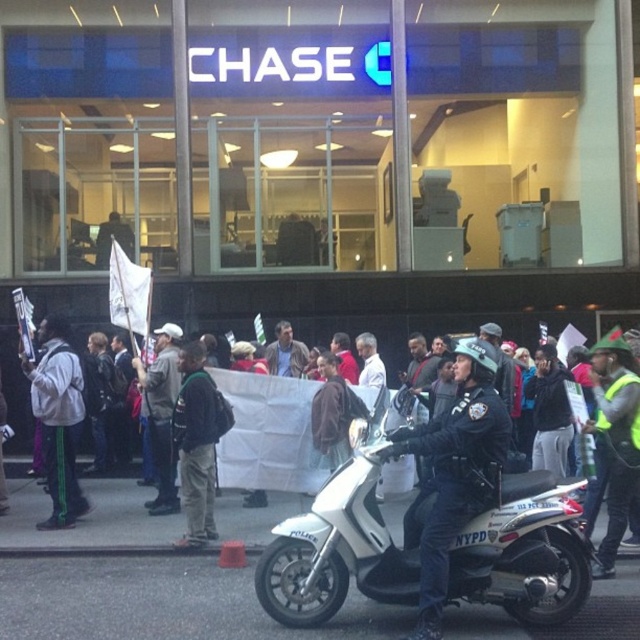
Question: Which point is farther to the camera?

Choices:
 (A) white matte motorcycle at center
 (B) black leather helmet at center
 (C) brown leather jacket at center

Answer: (C)

Question: From the image, what is the correct spatial relationship of dark gray backpack at center in relation to brown leather jacket at center?

Choices:
 (A) left
 (B) right

Answer: (A)

Question: Can you confirm if white matte motorcycle at center is positioned above brown leather jacket at center?

Choices:
 (A) no
 (B) yes

Answer: (A)

Question: Does dark gray backpack at center appear under brown leather jacket at center?

Choices:
 (A) no
 (B) yes

Answer: (B)

Question: Based on their relative distances, which object is nearer to the white matte motorcycle at center?

Choices:
 (A) white fabric banner at center
 (B) gray fabric jacket at center
 (C) dark gray backpack at center
 (D) brown leather jacket at center

Answer: (C)

Question: Which object appears farthest from the camera in this image?

Choices:
 (A) white matte motorcycle at center
 (B) brown leather jacket at center
 (C) gray fabric jacket at center
 (D) black leather helmet at center

Answer: (B)